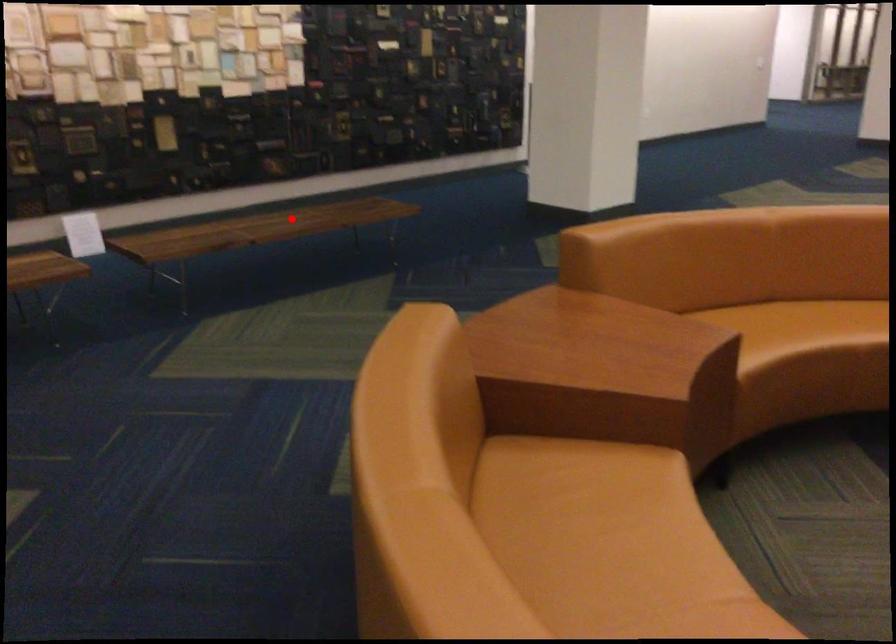
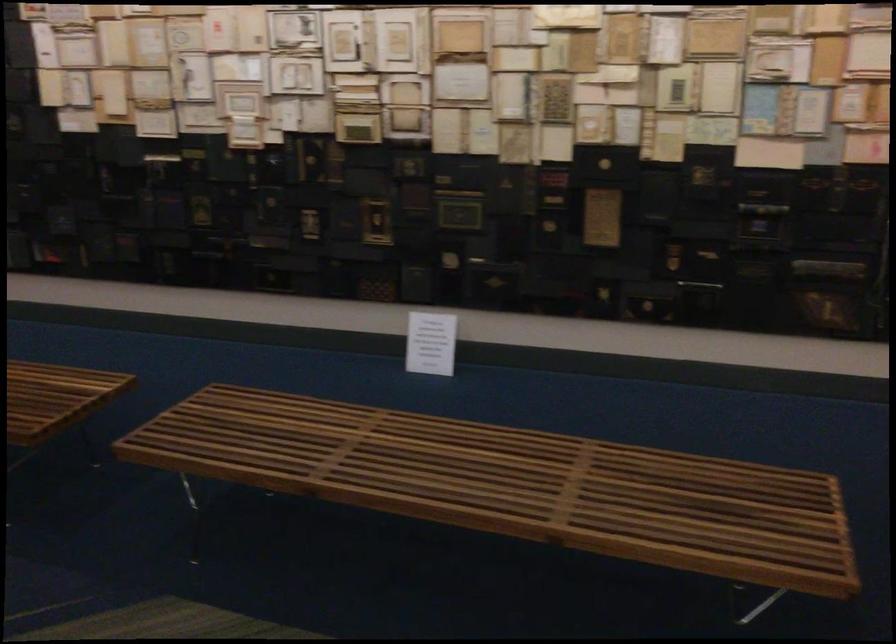
The point at the highlighted location is marked in the first image. Where is the corresponding point in the second image?

(501, 475)